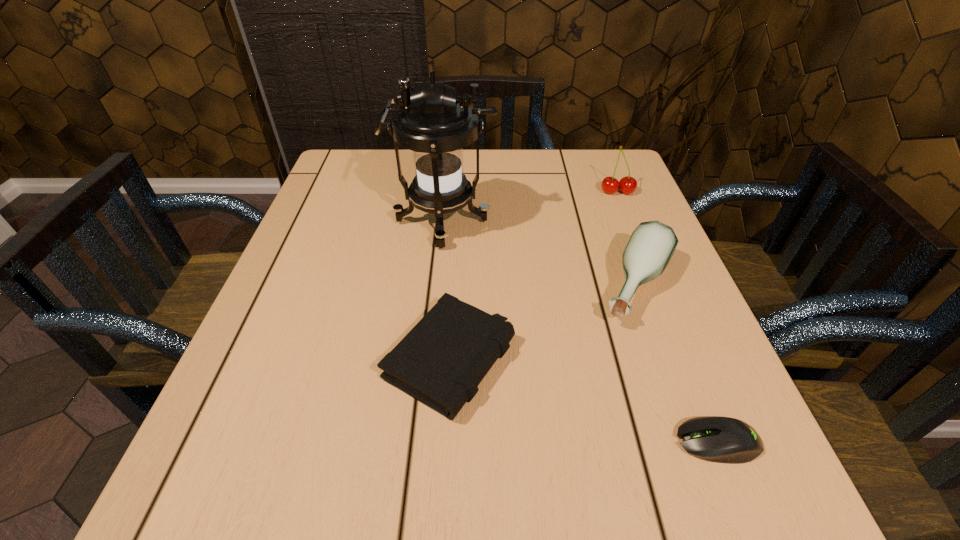
This screenshot has width=960, height=540. In order to click on blank area in the image that satisfies the following two spatial constraints: 1. on the back side of the bottle; 2. on the left side of the second shortest object in this screenshot , I will do `click(455, 287)`.